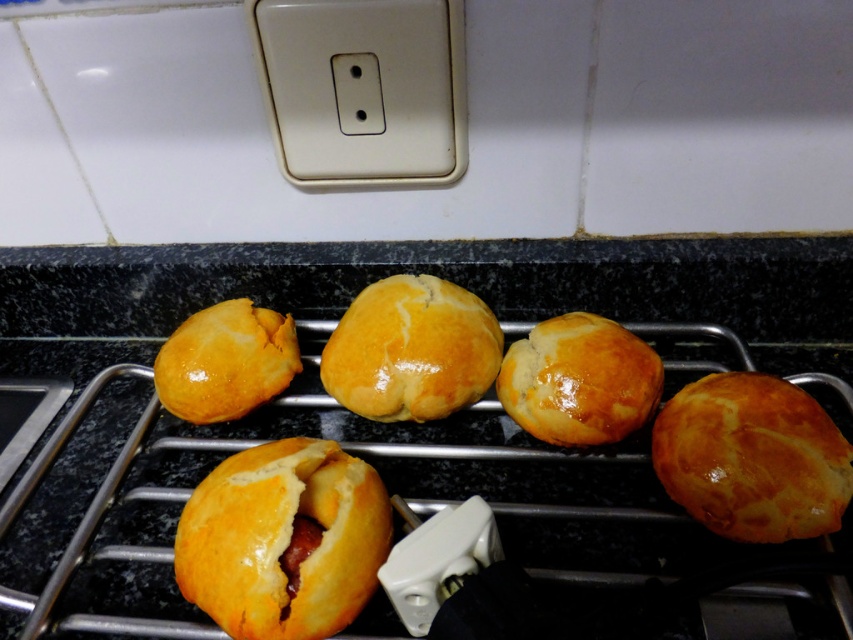
Question: Can you confirm if beige plastic switch at upper center is positioned to the left of glossy golden bun at center?

Choices:
 (A) no
 (B) yes

Answer: (B)

Question: From the image, what is the correct spatial relationship of beige plastic switch at upper center in relation to glossy golden bun at left?

Choices:
 (A) left
 (B) right

Answer: (B)

Question: Which object appears closest to the camera in this image?

Choices:
 (A) glossy golden bun at center
 (B) glossy golden bun at left

Answer: (A)

Question: Which of the following is the farthest from the observer?

Choices:
 (A) golden-brown flaky pastry at lower left
 (B) beige plastic switch at upper center

Answer: (B)

Question: Observing the image, what is the correct spatial positioning of golden-brown crusty bun at center in reference to golden matte bun at center?

Choices:
 (A) right
 (B) left

Answer: (B)

Question: Estimate the real-world distances between objects in this image. Which object is closer to the glossy golden bun at center?

Choices:
 (A) golden-brown crusty bun at center-right
 (B) beige plastic switch at upper center
 (C) golden-brown crusty bun at center

Answer: (A)